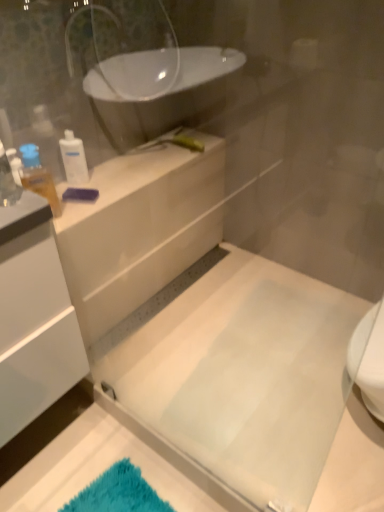
Locate an element on the screen. The image size is (384, 512). free point above white glossy counter at upper left (from a real-world perspective) is located at coordinates (140, 164).